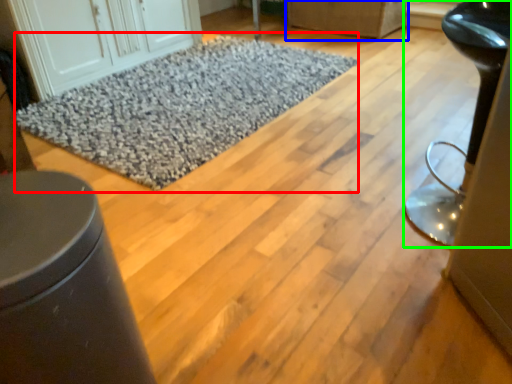
Question: Based on their relative distances, which object is farther from mat (highlighted by a red box)? Choose from furniture (highlighted by a blue box) and furniture (highlighted by a green box).

Choices:
 (A) furniture
 (B) furniture

Answer: (B)